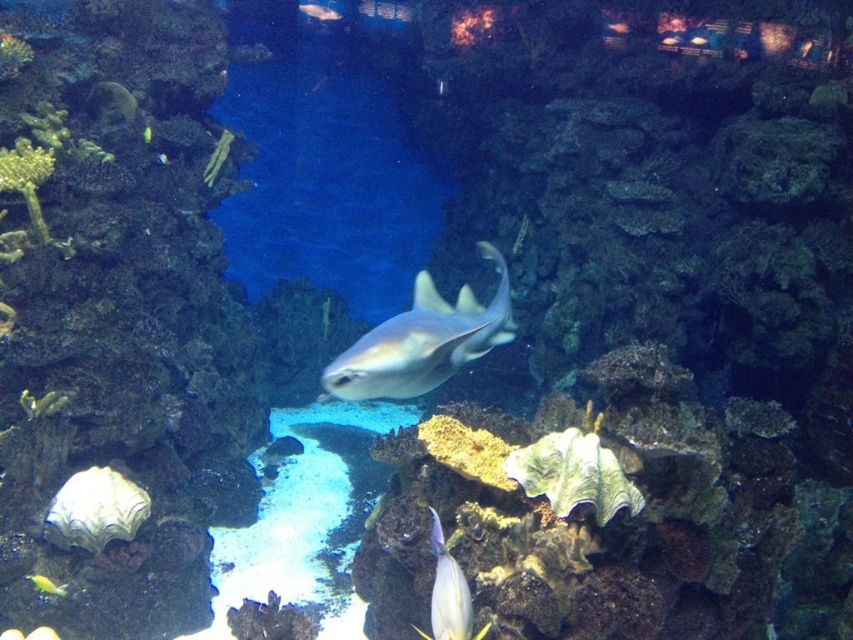
Question: Is matte gray shark at center to the right of shiny silver fish at lower center from the viewer's perspective?

Choices:
 (A) yes
 (B) no

Answer: (A)

Question: Does matte gray shark at center have a larger size compared to shiny silver fish at lower center?

Choices:
 (A) yes
 (B) no

Answer: (A)

Question: Which of the following is the closest to the observer?

Choices:
 (A) matte gray shark at center
 (B) shiny green fish at upper left

Answer: (A)

Question: Which object is positioned farthest from the shiny green fish at upper left?

Choices:
 (A) shiny silver fish at upper center
 (B) smooth yellow fish at upper left
 (C) yellow matte fish at lower left
 (D) matte gray shark at center

Answer: (A)

Question: Which object is positioned farthest from the shiny silver fish at upper center?

Choices:
 (A) shiny silver fish at lower center
 (B) smooth yellow fish at upper left

Answer: (A)

Question: Can you confirm if matte gray shark at center is positioned above shiny silver fish at upper center?

Choices:
 (A) yes
 (B) no

Answer: (B)